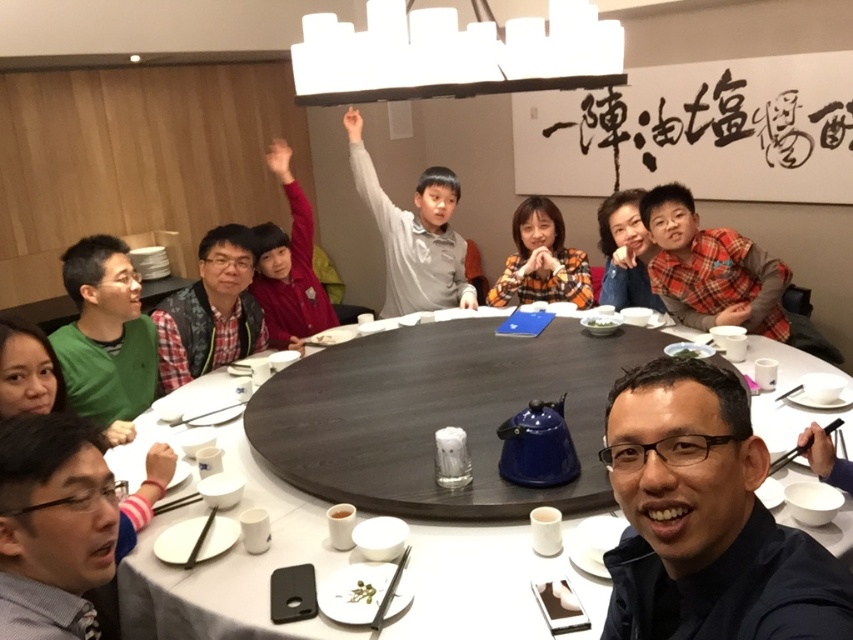
You are at the dining table and want to place a small decoration between the two points, point (622, 541) and point (558, 216). Which point should you move the decoration closer to so it appears larger in the photo?

To make the decoration appear larger in the photo, you should place it closer to point (622, 541) because it is closer to the viewer than point (558, 216).